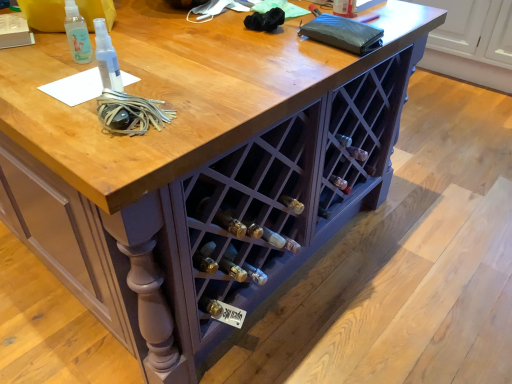
What is the approximate width of clear plastic spray bottle at upper left?

It is 2.07 inches.

What is the approximate height of clear plastic spray bottle at upper left?

The height of clear plastic spray bottle at upper left is 6.03 inches.

Where is `clear plastic spray bottle at upper left`? The height and width of the screenshot is (384, 512). clear plastic spray bottle at upper left is located at coordinates (77, 34).

What do you see at coordinates (77, 34) in the screenshot? This screenshot has height=384, width=512. I see `clear plastic spray bottle at upper left` at bounding box center [77, 34].

Image resolution: width=512 pixels, height=384 pixels. Identify the location of clear plastic spray bottle at upper left. (77, 34).